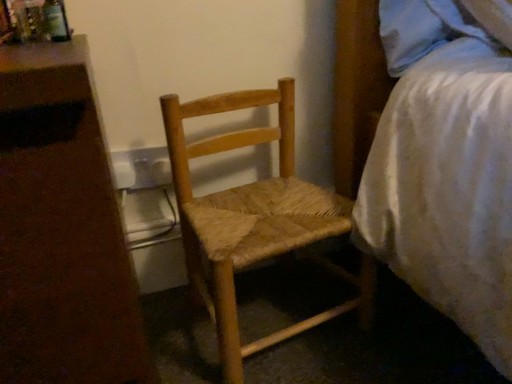
Question: In the image, is white plastic nightstand at left positioned in front of or behind natural wood woven chair at center?

Choices:
 (A) front
 (B) behind

Answer: (A)

Question: Considering the positions of white plastic nightstand at left and natural wood woven chair at center in the image, is white plastic nightstand at left bigger or smaller than natural wood woven chair at center?

Choices:
 (A) small
 (B) big

Answer: (B)

Question: Which object is positioned closest to the white textured bed at right?

Choices:
 (A) natural wood woven chair at center
 (B) white plastic nightstand at left

Answer: (A)

Question: Estimate the real-world distances between objects in this image. Which object is farther from the natural wood woven chair at center?

Choices:
 (A) white plastic nightstand at left
 (B) white textured bed at right

Answer: (A)